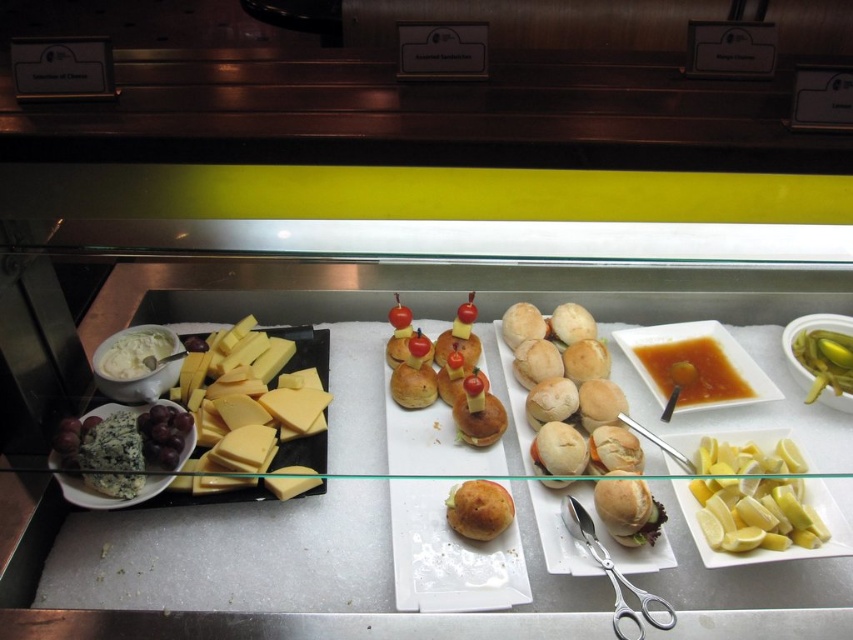
Can you confirm if yellow hard cheese at left is thinner than yellow glossy lemon at right?

No, yellow hard cheese at left is not thinner than yellow glossy lemon at right.

Can you confirm if yellow hard cheese at left is wider than yellow glossy lemon at right?

Yes, yellow hard cheese at left is wider than yellow glossy lemon at right.

The height and width of the screenshot is (640, 853). Describe the element at coordinates (259, 378) in the screenshot. I see `yellow hard cheese at left` at that location.

Image resolution: width=853 pixels, height=640 pixels. Identify the location of yellow hard cheese at left. (259, 378).

Does yellow translucent lemon slices at lower right have a greater width compared to silver metallic scissors at lower right?

Yes, yellow translucent lemon slices at lower right is wider than silver metallic scissors at lower right.

At what (x,y) coordinates should I click in order to perform the action: click on yellow translucent lemon slices at lower right. Please return your answer as a coordinate pair (x, y). This screenshot has height=640, width=853. Looking at the image, I should click on (753, 499).

Where is `yellow translucent lemon slices at lower right`? The width and height of the screenshot is (853, 640). yellow translucent lemon slices at lower right is located at coordinates (753, 499).

Does yellow hard cheese at left have a greater height compared to white creamy spread at center left?

Indeed, yellow hard cheese at left has a greater height compared to white creamy spread at center left.

Does yellow hard cheese at left have a lesser width compared to white creamy spread at center left?

No, yellow hard cheese at left is not thinner than white creamy spread at center left.

Which is in front, point (271, 326) or point (125, 339)?

Positioned in front is point (125, 339).

The width and height of the screenshot is (853, 640). I want to click on yellow hard cheese at left, so click(x=259, y=378).